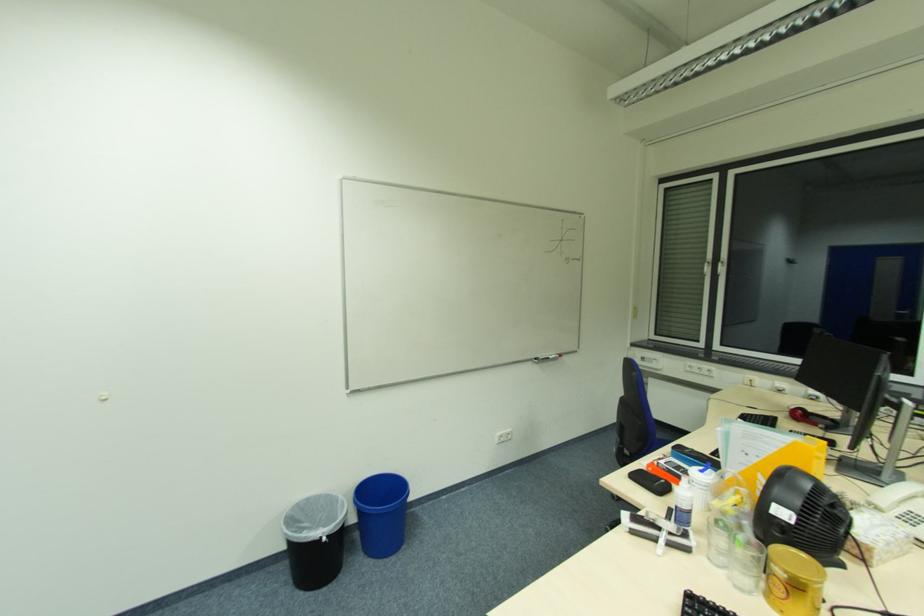
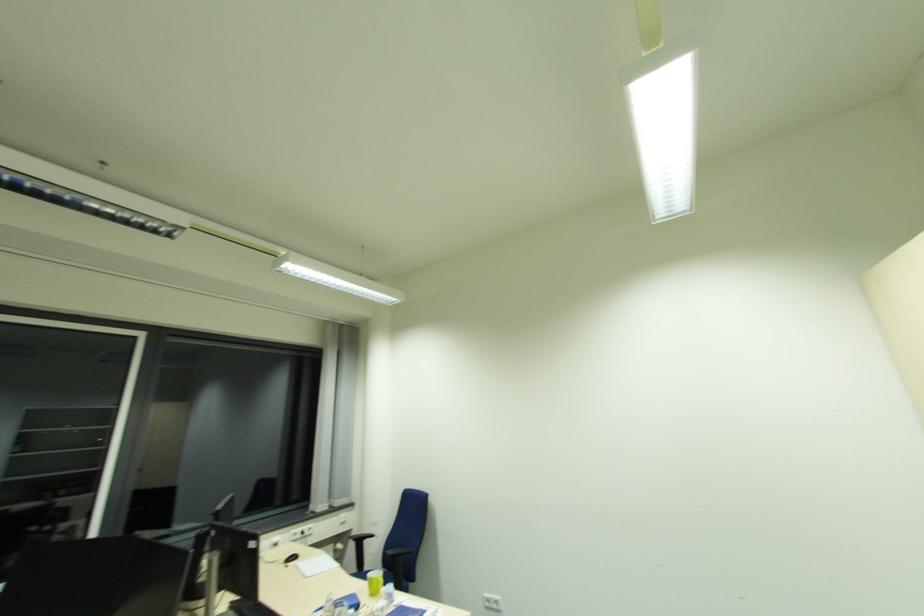
Question: The images are taken continuously from a first-person perspective. In which direction is your viewpoint rotating?

Choices:
 (A) Left
 (B) Right
 (C) Up
 (D) Down

Answer: (B)